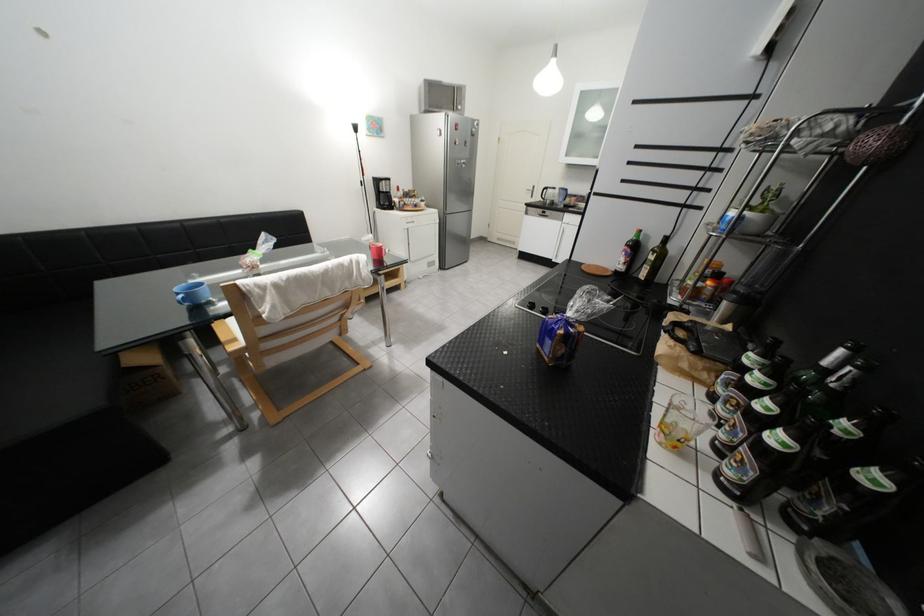
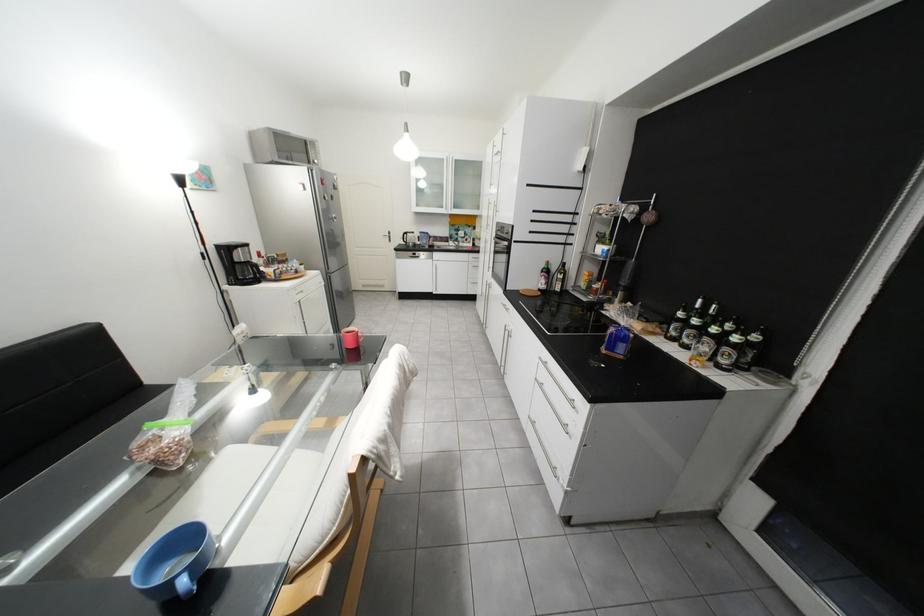
In the second image, find the point that corresponds to pixel 192 297 in the first image.

(195, 582)